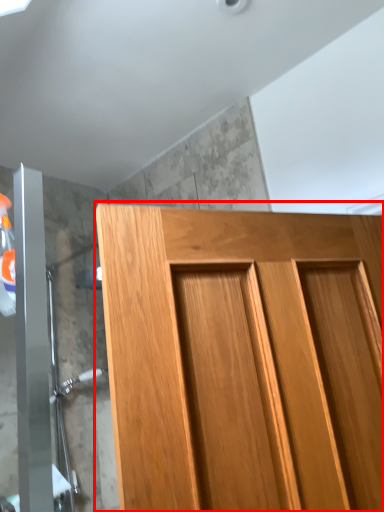
Question: From the image's perspective, what is the correct spatial relationship of door (annotated by the red box) in relation to shower door?

Choices:
 (A) above
 (B) below

Answer: (A)